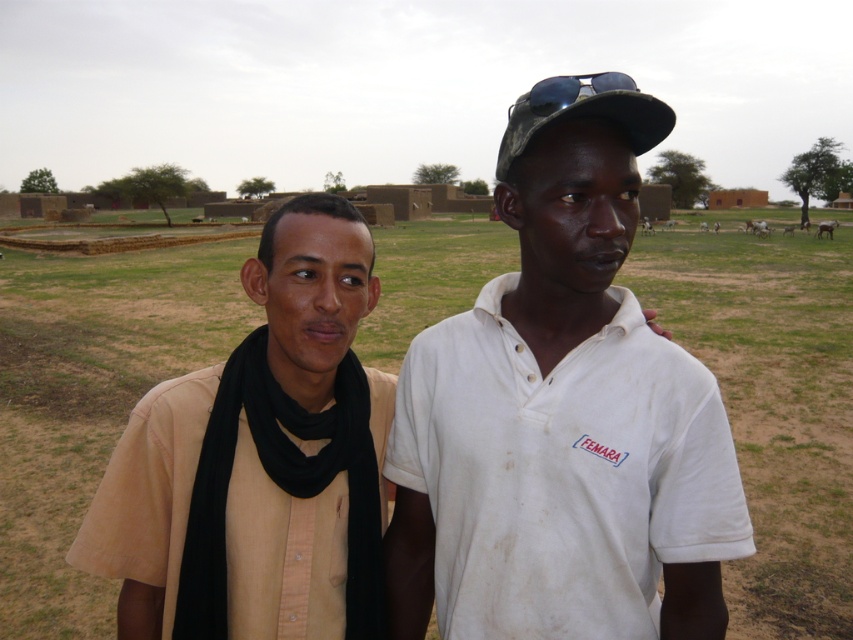
You are standing in a rural area and see a beige fabric shirt at center. If you want to take a photo of it with your phone, which has a maximum focus range of 10 feet, will you be able to capture it clearly?

The beige fabric shirt at center is 14.21 feet away from the camera, which exceeds the phone camera maximum focus range of 10 feet. Therefore, the photo will not be clear.

You are a photographer trying to capture a clear shot of the white cotton shirt at center and the camouflage fabric baseball cap at upper center. Which object should you focus on first if you want to ensure both are in focus without adjusting your camera settings?

The white cotton shirt at center is not as tall as the camouflage fabric baseball cap at upper center, so you should focus on the camouflage fabric baseball cap at upper center first since it is taller and likely farther away, ensuring depth of field covers both.